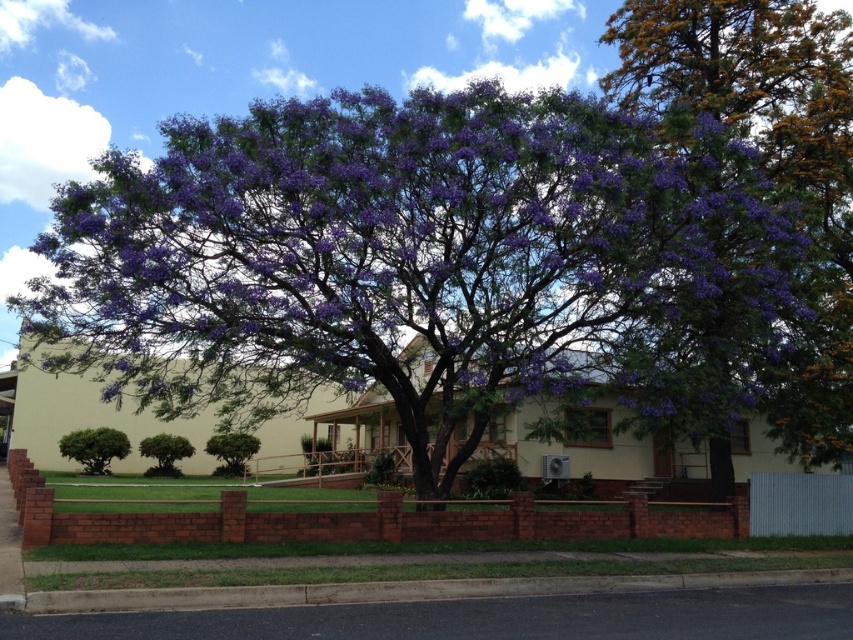
Can you confirm if purple leafy tree at upper right is smaller than green leafy bush at lower left?

Actually, purple leafy tree at upper right might be larger than green leafy bush at lower left.

Describe the element at coordinates (769, 163) in the screenshot. I see `purple leafy tree at upper right` at that location.

Does point (811, 164) lie behind point (85, 449)?

No, it is not.

At what (x,y) coordinates should I click in order to perform the action: click on purple leafy tree at upper right. Please return your answer as a coordinate pair (x, y). Looking at the image, I should click on (769, 163).

Who is higher up, purple leafy tree at upper right or green leafy bush at center?

purple leafy tree at upper right

Which is more to the right, purple leafy tree at upper right or green leafy bush at center?

Positioned to the right is purple leafy tree at upper right.

Which is behind, point (769, 72) or point (160, 440)?

The point (160, 440) is behind.

Locate an element on the screen. purple leafy tree at upper right is located at coordinates (769, 163).

Is purple matte flowers at center positioned before green leafy bush at center?

Yes.

Who is positioned more to the right, purple matte flowers at center or green leafy bush at center?

purple matte flowers at center

The width and height of the screenshot is (853, 640). I want to click on purple matte flowers at center, so click(x=402, y=253).